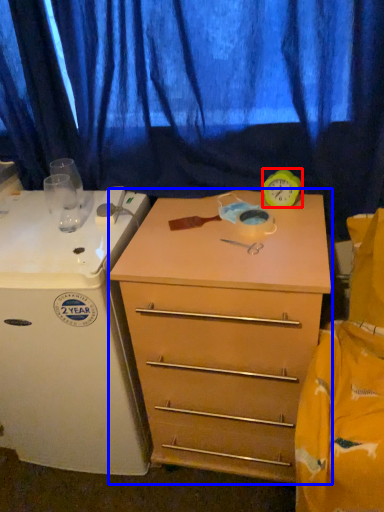
Question: Which point is further to the camera, clock (highlighted by a red box) or chest of drawers (highlighted by a blue box)?

Choices:
 (A) clock
 (B) chest of drawers

Answer: (A)